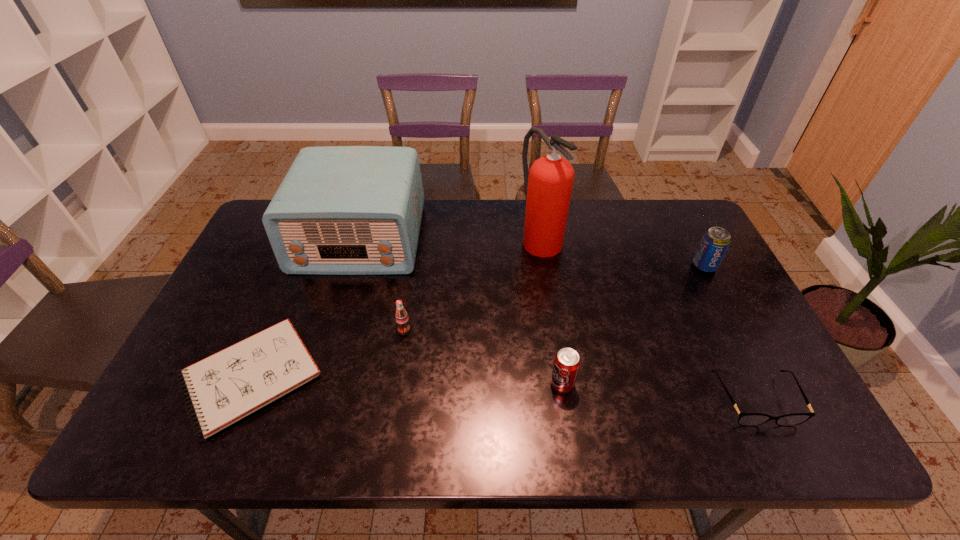
The height and width of the screenshot is (540, 960). I want to click on fire extinguisher, so click(x=548, y=186).

Locate an element on the screen. Image resolution: width=960 pixels, height=540 pixels. radio receiver is located at coordinates (340, 210).

Locate an element on the screen. This screenshot has width=960, height=540. the rightmost soda is located at coordinates (715, 242).

Identify the location of the leftmost soda. (401, 316).

At what (x,y) coordinates should I click in order to perform the action: click on the second soda from left to right. Please return your answer as a coordinate pair (x, y). Looking at the image, I should click on (566, 364).

Where is `spectacles`? Image resolution: width=960 pixels, height=540 pixels. spectacles is located at coordinates (745, 419).

Locate an element on the screen. the shortest object is located at coordinates (225, 387).

Where is `free point located 0.160m on the handle side of the fire extinguisher`? This screenshot has width=960, height=540. free point located 0.160m on the handle side of the fire extinguisher is located at coordinates (550, 300).

Locate an element on the screen. free space located 0.170m on the front panel of the radio receiver is located at coordinates (335, 321).

The image size is (960, 540). What are the coordinates of `free space located on the front of the farthest soda` in the screenshot? It's located at (716, 289).